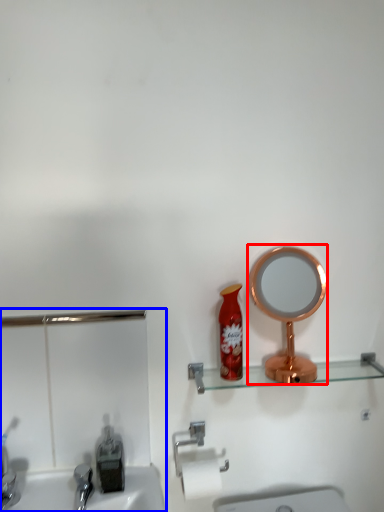
Question: Which of the following is the closest to the observer, mirror (highlighted by a red box) or sink (highlighted by a blue box)?

Choices:
 (A) mirror
 (B) sink

Answer: (B)